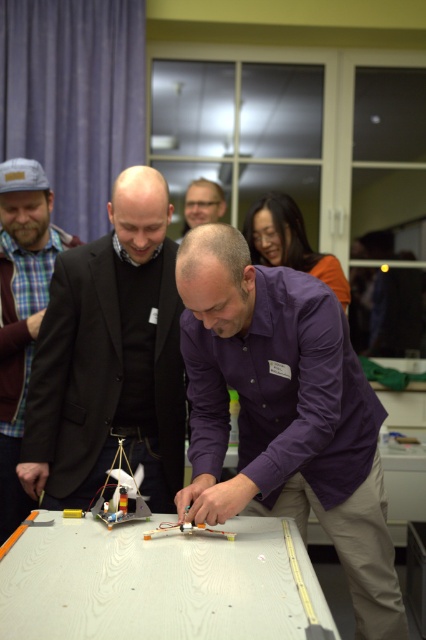
You are standing in the room and want to place a large poster on the wall above the white wood table at center. However, you need to ensure that the plaid fabric shirt at left won

The white wood table at center is below the plaid fabric shirt at left, so placing the poster above the table would position it below the plaid fabric shirt at left. This means the poster would not interfere with the plaid fabric shirt at left, so it should be safe to place it there.

You are a photographer at the event and need to capture a photo of both the purple cotton shirt at center and the plaid fabric shirt at left. Which person should you position closer to the camera to ensure both shirts are fully visible in the frame?

The purple cotton shirt at center is shorter than the plaid fabric shirt at left, so you should position the person wearing the purple cotton shirt at center closer to the camera to ensure both shirts are fully visible in the frame.

You are a photographer at the event and need to ensure both the purple cotton shirt at center and the plaid fabric shirt at left are visible in the photo. Given that the camera has a fixed focus, which shirt should you prioritize to ensure clarity, considering their sizes?

The purple cotton shirt at center is larger in size compared to the plaid fabric shirt at left, so prioritize focusing on the purple cotton shirt at center to ensure clarity since larger objects are easier to capture clearly at a fixed focus.